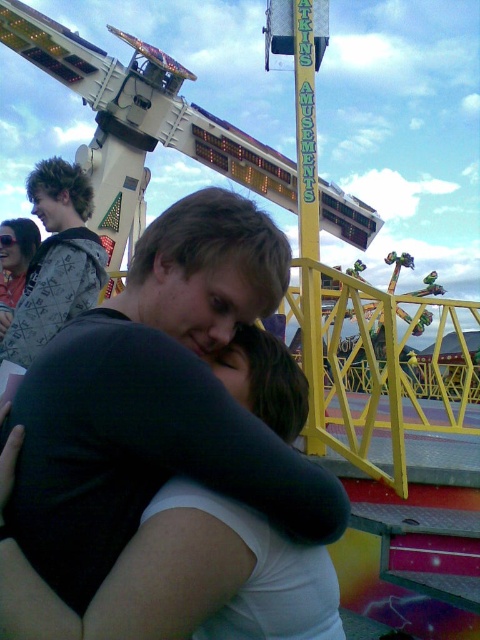
Question: Does black matte shirt at center appear over sweater at upper left?

Choices:
 (A) no
 (B) yes

Answer: (A)

Question: Is black matte shirt at center smaller than sweater at upper left?

Choices:
 (A) no
 (B) yes

Answer: (A)

Question: Can you confirm if black matte shirt at center is wider than sweater at upper left?

Choices:
 (A) yes
 (B) no

Answer: (A)